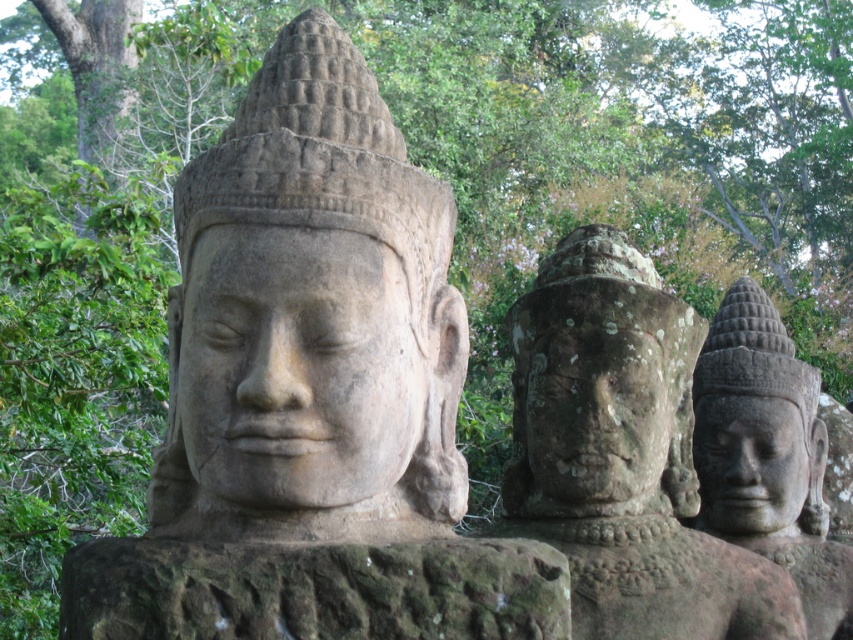
Question: Can you confirm if rough stone statue at center is smaller than carved stone head at center?

Choices:
 (A) no
 (B) yes

Answer: (A)

Question: Is gray stone statue at center positioned in front of green mossy rock at center?

Choices:
 (A) no
 (B) yes

Answer: (A)

Question: Among these objects, which one is nearest to the camera?

Choices:
 (A) green mossy rock at center
 (B) gray stone statue at center
 (C) carved stone head at center
 (D) stone statue at center

Answer: (A)

Question: Among these points, which one is nearest to the camera?

Choices:
 (A) (657, 401)
 (B) (602, 477)
 (C) (375, 275)
 (D) (555, 444)

Answer: (C)

Question: Can you confirm if carved stone head at center is wider than gray stone face at right?

Choices:
 (A) no
 (B) yes

Answer: (B)

Question: Among these points, which one is nearest to the camera?

Choices:
 (A) (654, 563)
 (B) (257, 513)
 (C) (212, 456)

Answer: (C)